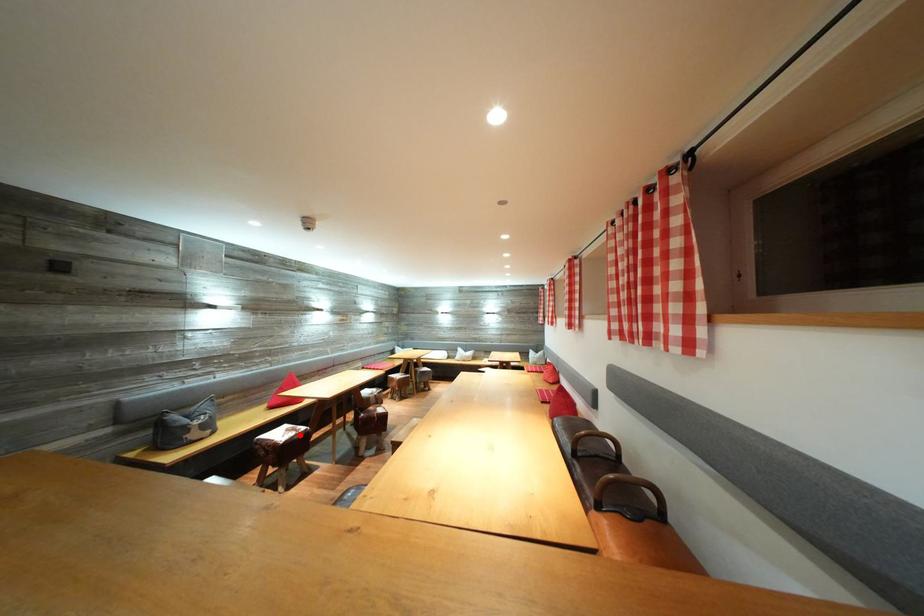
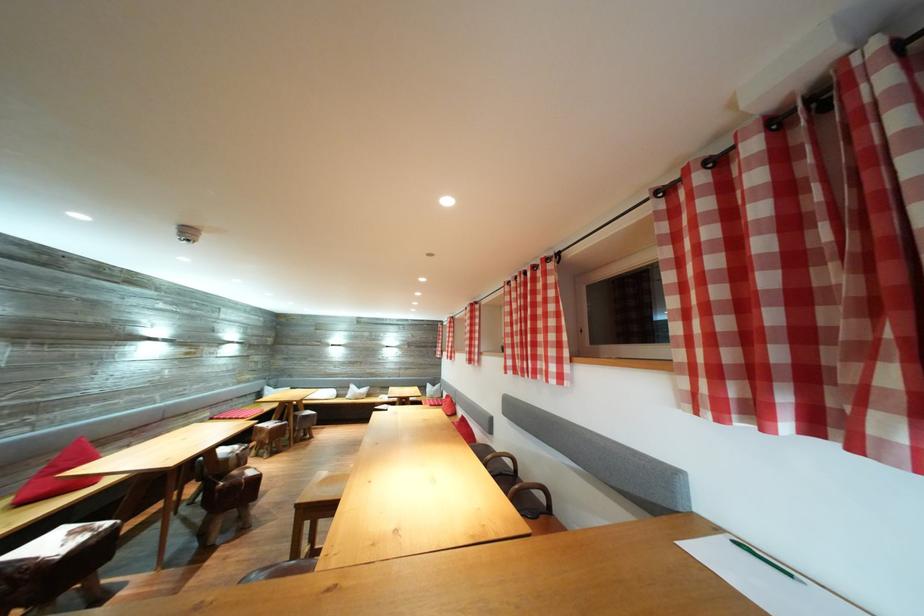
In the second image, find the point that corresponds to the highlighted location in the first image.

(91, 536)